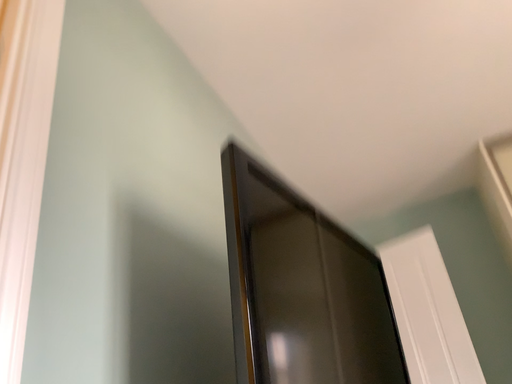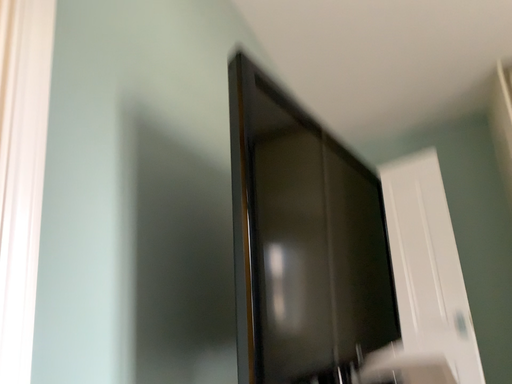
Question: Which way did the camera rotate in the video?

Choices:
 (A) rotated downward
 (B) rotated upward

Answer: (A)